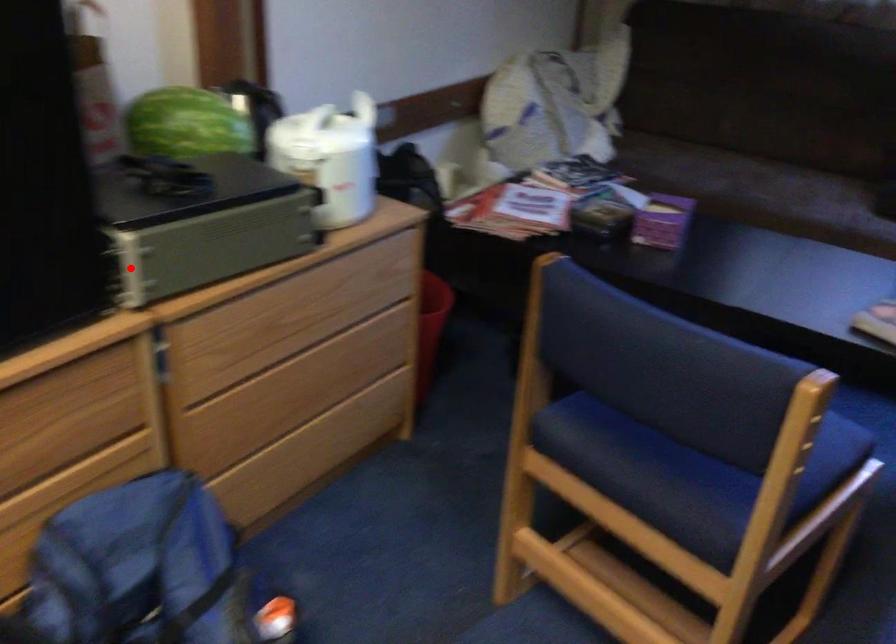
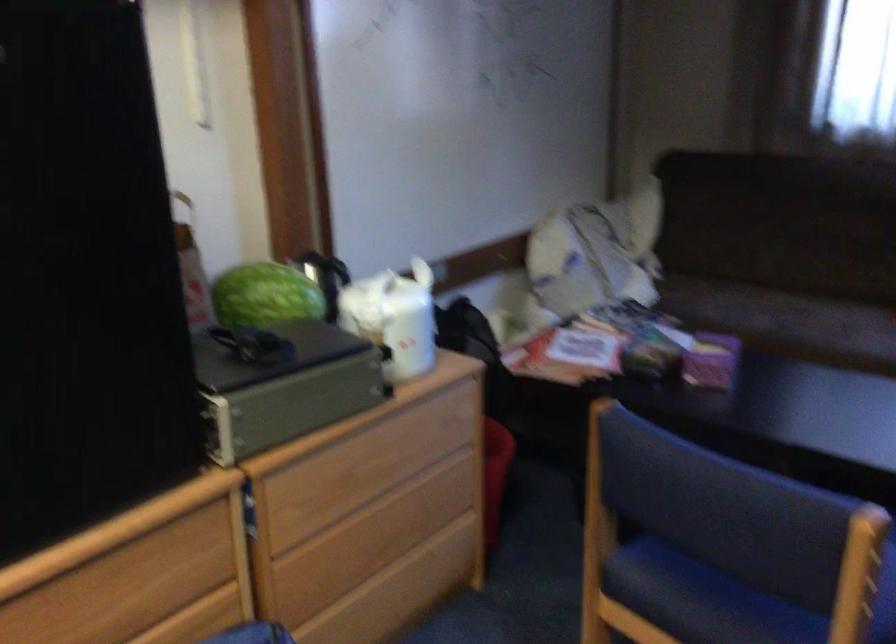
Where in the second image is the point corresponding to the highlighted location from the first image?

(222, 433)